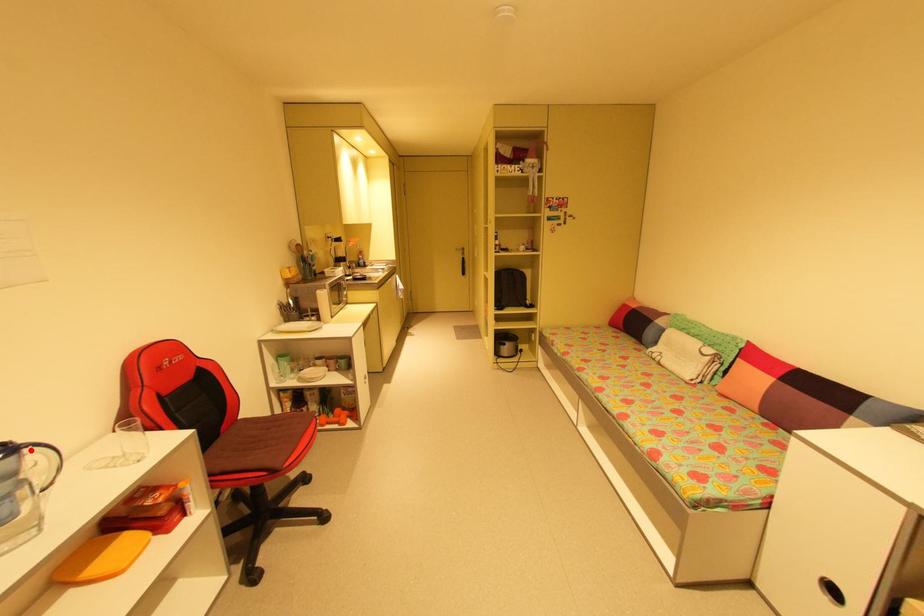
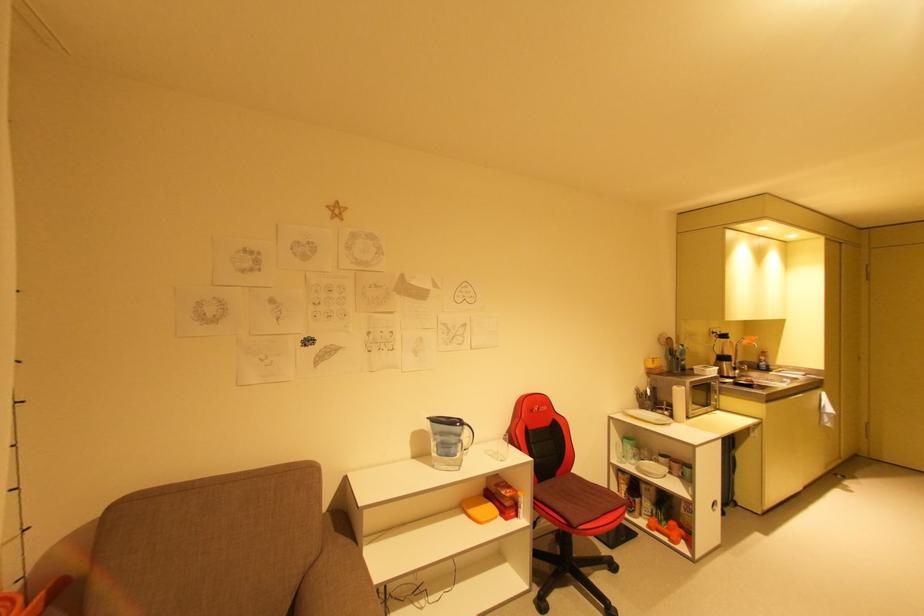
Locate, in the second image, the point that corresponds to the highlighted location in the first image.

(469, 427)